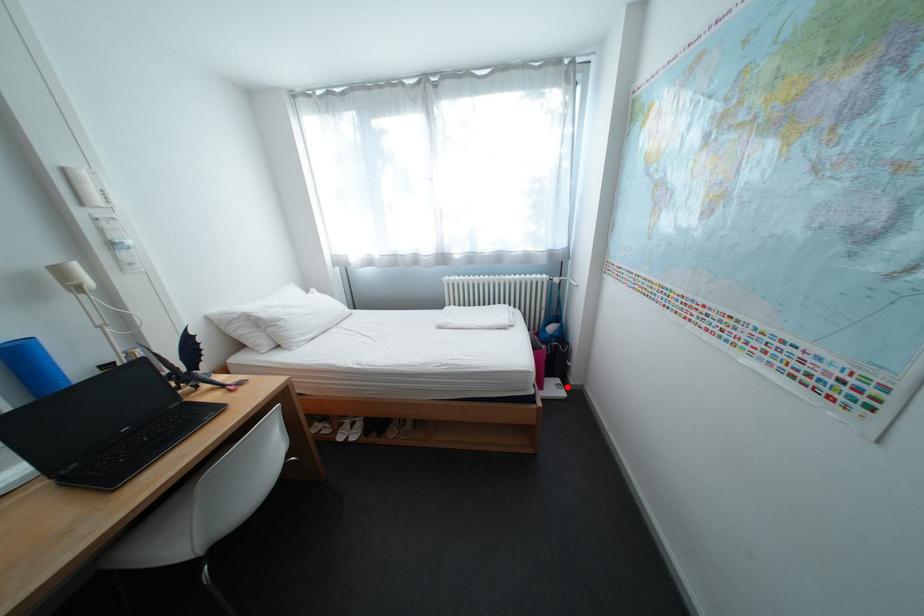
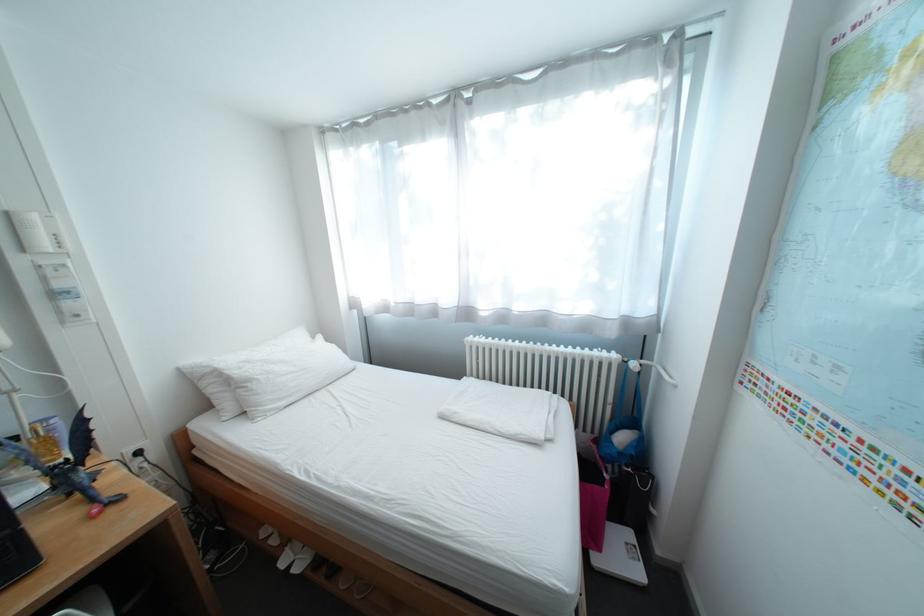
Question: I am providing you with two images of the same scene from different viewpoints. Image1 has a red point marked. In image2, the corresponding 3D location appears at what relative position? Reply with the corresponding letter.

Choices:
 (A) Closer
 (B) Farther

Answer: (A)